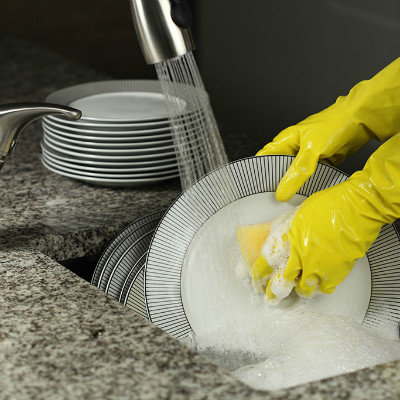
This screenshot has width=400, height=400. What are the coordinates of `sponge` in the screenshot? It's located at (257, 233).